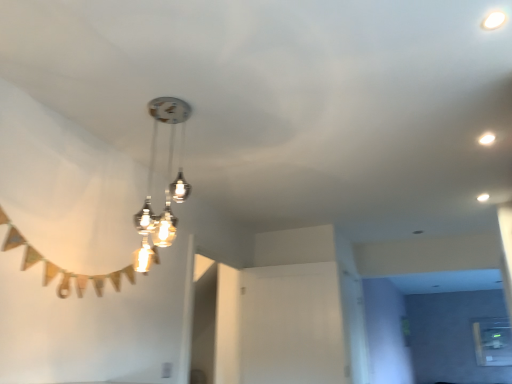
The image size is (512, 384). What do you see at coordinates (493, 20) in the screenshot?
I see `white glossy droplight at upper right` at bounding box center [493, 20].

Where is `white glossy droplight at upper right`? Image resolution: width=512 pixels, height=384 pixels. white glossy droplight at upper right is located at coordinates (493, 20).

The image size is (512, 384). What do you see at coordinates (165, 189) in the screenshot?
I see `metallic glass chandelier at center` at bounding box center [165, 189].

I want to click on transparent glass window at lower right, so click(492, 341).

Is transparent glass window at lower right far away from white glossy droplight at upper right?

Yes, transparent glass window at lower right and white glossy droplight at upper right are located far from each other.

Does point (495, 351) come behind point (504, 18)?

Yes, it is.

Find the location of a particular element. The image size is (512, 384). droplight to the left of transparent glass window at lower right is located at coordinates (493, 20).

Is transparent glass window at lower right taller than white glossy droplight at upper right?

Yes, transparent glass window at lower right is taller than white glossy droplight at upper right.

Is transparent glass window at lower right oriented towards metallic glass chandelier at center?

Yes, transparent glass window at lower right is oriented towards metallic glass chandelier at center.

Relative to metallic glass chandelier at center, is transparent glass window at lower right in front or behind?

In the image, transparent glass window at lower right appears behind metallic glass chandelier at center.

From a real-world perspective, is transparent glass window at lower right positioned above or below metallic glass chandelier at center?

transparent glass window at lower right is below metallic glass chandelier at center.

Between transparent glass window at lower right and metallic glass chandelier at center, which one appears on the right side from the viewer's perspective?

transparent glass window at lower right.

Would you say white glossy droplight at upper right is inside or outside transparent glass window at lower right?

white glossy droplight at upper right is outside transparent glass window at lower right.

Where is `droplight in front of the transparent glass window at lower right`? This screenshot has width=512, height=384. droplight in front of the transparent glass window at lower right is located at coordinates (493, 20).

From the picture: Can you see white glossy droplight at upper right touching transparent glass window at lower right?

No.

From a real-world perspective, is white glossy droplight at upper right above or below transparent glass window at lower right?

white glossy droplight at upper right is above transparent glass window at lower right.

From a real-world perspective, is metallic glass chandelier at center over white glossy droplight at upper right?

No.

Considering the relative sizes of metallic glass chandelier at center and white glossy droplight at upper right in the image provided, is metallic glass chandelier at center bigger than white glossy droplight at upper right?

Yes, metallic glass chandelier at center is bigger than white glossy droplight at upper right.

Does metallic glass chandelier at center appear on the right side of white glossy droplight at upper right?

No, metallic glass chandelier at center is not to the right of white glossy droplight at upper right.

Looking at this image, does metallic glass chandelier at center lie in front of white glossy droplight at upper right?

No, the depth of metallic glass chandelier at center is greater than that of white glossy droplight at upper right.

Which object is closer to the camera taking this photo, white glossy droplight at upper right or metallic glass chandelier at center?

Positioned in front is white glossy droplight at upper right.

Is white glossy droplight at upper right oriented towards metallic glass chandelier at center?

Yes, white glossy droplight at upper right is oriented towards metallic glass chandelier at center.

I want to click on droplight above the metallic glass chandelier at center (from the image's perspective), so click(493, 20).

From the image's perspective, who appears lower, white glossy droplight at upper right or metallic glass chandelier at center?

metallic glass chandelier at center.

Is metallic glass chandelier at center smaller than transparent glass window at lower right?

Actually, metallic glass chandelier at center might be larger than transparent glass window at lower right.

Does metallic glass chandelier at center touch transparent glass window at lower right?

They are not placed beside each other.

Who is taller, metallic glass chandelier at center or transparent glass window at lower right?

metallic glass chandelier at center is taller.

Is metallic glass chandelier at center aimed at transparent glass window at lower right?

No, metallic glass chandelier at center is not oriented towards transparent glass window at lower right.

The height and width of the screenshot is (384, 512). What are the coordinates of `droplight above the transparent glass window at lower right (from the image's perspective)` in the screenshot? It's located at (493, 20).

The image size is (512, 384). What are the coordinates of `lamp located in front of the transparent glass window at lower right` in the screenshot? It's located at (165, 189).

In the scene shown: Looking at the image, which one is located closer to transparent glass window at lower right, metallic glass chandelier at center or white glossy droplight at upper right?

metallic glass chandelier at center is positioned closer to the anchor transparent glass window at lower right.

Based on their spatial positions, is metallic glass chandelier at center or transparent glass window at lower right further from white glossy droplight at upper right?

transparent glass window at lower right lies further to white glossy droplight at upper right than the other object.

Which object lies further to the anchor point white glossy droplight at upper right, transparent glass window at lower right or metallic glass chandelier at center?

Based on the image, transparent glass window at lower right appears to be further to white glossy droplight at upper right.

When comparing their distances from metallic glass chandelier at center, does white glossy droplight at upper right or transparent glass window at lower right seem closer?

white glossy droplight at upper right.

Which object lies nearer to the anchor point transparent glass window at lower right, white glossy droplight at upper right or metallic glass chandelier at center?

metallic glass chandelier at center is closer to transparent glass window at lower right.

From the image, which object appears to be farther from metallic glass chandelier at center, transparent glass window at lower right or white glossy droplight at upper right?

transparent glass window at lower right lies further to metallic glass chandelier at center than the other object.

Locate an element on the screen. lamp between white glossy droplight at upper right and transparent glass window at lower right from front to back is located at coordinates (165, 189).